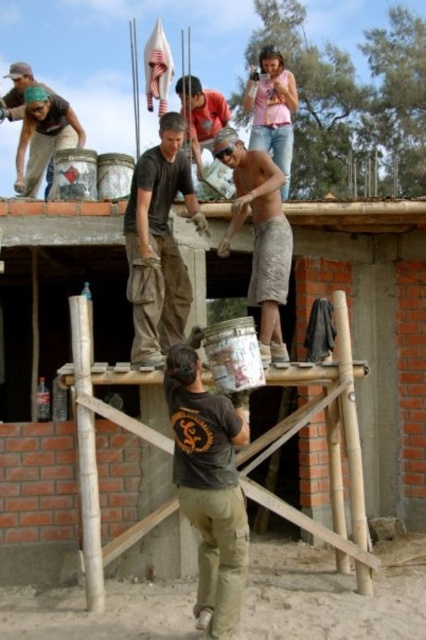
Is matte brown pants at center above matte gray shirt at center?

Incorrect, matte brown pants at center is not positioned above matte gray shirt at center.

Describe the element at coordinates (158, 243) in the screenshot. I see `matte brown pants at center` at that location.

This screenshot has height=640, width=426. Find the location of `matte brown pants at center`. matte brown pants at center is located at coordinates (158, 243).

Can you confirm if dark brown fabric shirt at center is wider than camouflage fabric shorts at center?

In fact, dark brown fabric shirt at center might be narrower than camouflage fabric shorts at center.

Is dark brown fabric shirt at center positioned before camouflage fabric shorts at center?

Yes, dark brown fabric shirt at center is closer to the viewer.

At what (x,y) coordinates should I click in order to perform the action: click on dark brown fabric shirt at center. Please return your answer as a coordinate pair (x, y). Looking at the image, I should click on (209, 486).

Does pink cotton shirt at upper center have a greater width compared to matte gray shirt at center?

Yes, pink cotton shirt at upper center is wider than matte gray shirt at center.

Find the location of a particular element. This screenshot has height=640, width=426. pink cotton shirt at upper center is located at coordinates (271, 109).